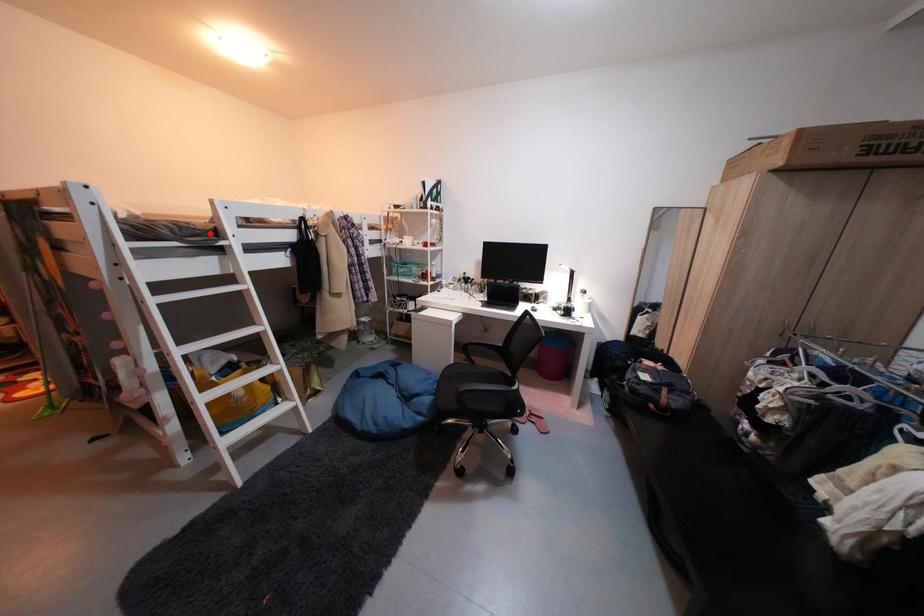
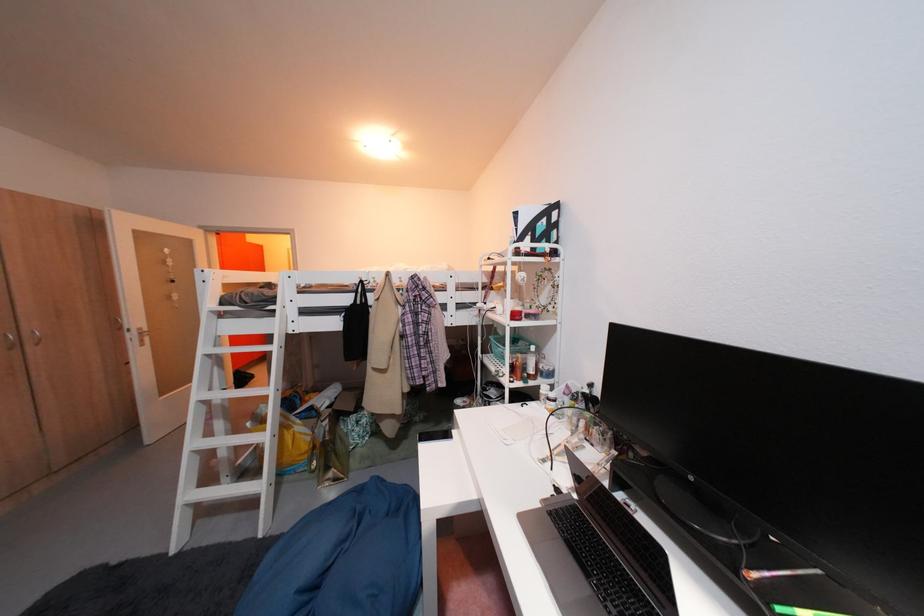
Question: I am providing you with two images of the same scene from different viewpoints. A red point is marked on the first image. At the location where the point appears in image 1, is it still visible in image 2?

Choices:
 (A) Yes
 (B) No

Answer: (A)